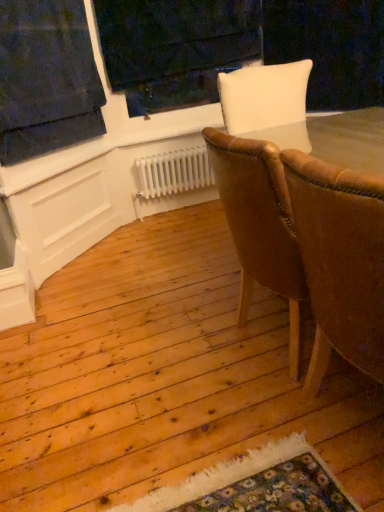
Question: Does brown leather chair at right, acting as the 2th chair starting from the back, lie in front of brown leather chair at center, placed as the 2th chair when sorted from front to back?

Choices:
 (A) yes
 (B) no

Answer: (A)

Question: Is brown leather chair at right, acting as the 2th chair starting from the back, taller than brown leather chair at center, which is the first chair in back-to-front order?

Choices:
 (A) yes
 (B) no

Answer: (A)

Question: Is brown leather chair at right, which ranks as the 1th chair in front-to-back order, positioned with its back to brown leather chair at center, which is the first chair in back-to-front order?

Choices:
 (A) yes
 (B) no

Answer: (B)

Question: Is brown leather chair at right, which ranks as the 1th chair in front-to-back order, further to the viewer compared to brown leather chair at center, which is the first chair in back-to-front order?

Choices:
 (A) yes
 (B) no

Answer: (B)

Question: From the image's perspective, does brown leather chair at right, which ranks as the 1th chair in front-to-back order, appear lower than brown leather chair at center, which is the first chair in back-to-front order?

Choices:
 (A) yes
 (B) no

Answer: (A)

Question: Does brown leather chair at right, which ranks as the 1th chair in front-to-back order, have a lesser width compared to brown leather chair at center, which is the first chair in back-to-front order?

Choices:
 (A) yes
 (B) no

Answer: (A)

Question: Considering the relative sizes of brown leather chair at center, which is the first chair in back-to-front order, and white metallic radiator at center in the image provided, is brown leather chair at center, which is the first chair in back-to-front order, wider than white metallic radiator at center?

Choices:
 (A) no
 (B) yes

Answer: (B)

Question: Considering the relative sizes of brown leather chair at center, placed as the 2th chair when sorted from front to back, and white metallic radiator at center in the image provided, is brown leather chair at center, placed as the 2th chair when sorted from front to back, shorter than white metallic radiator at center?

Choices:
 (A) no
 (B) yes

Answer: (A)

Question: Considering the relative positions of brown leather chair at center, placed as the 2th chair when sorted from front to back, and white metallic radiator at center in the image provided, is brown leather chair at center, placed as the 2th chair when sorted from front to back, to the left of white metallic radiator at center from the viewer's perspective?

Choices:
 (A) yes
 (B) no

Answer: (B)

Question: Considering the relative sizes of brown leather chair at center, which is the first chair in back-to-front order, and white metallic radiator at center in the image provided, is brown leather chair at center, which is the first chair in back-to-front order, thinner than white metallic radiator at center?

Choices:
 (A) no
 (B) yes

Answer: (A)

Question: Is brown leather chair at center, which is the first chair in back-to-front order, positioned with its back to white metallic radiator at center?

Choices:
 (A) no
 (B) yes

Answer: (A)

Question: Can you confirm if brown leather chair at center, placed as the 2th chair when sorted from front to back, is smaller than white metallic radiator at center?

Choices:
 (A) no
 (B) yes

Answer: (A)

Question: Can you confirm if brown leather chair at right, acting as the 2th chair starting from the back, is thinner than white painted wood at upper center?

Choices:
 (A) no
 (B) yes

Answer: (A)